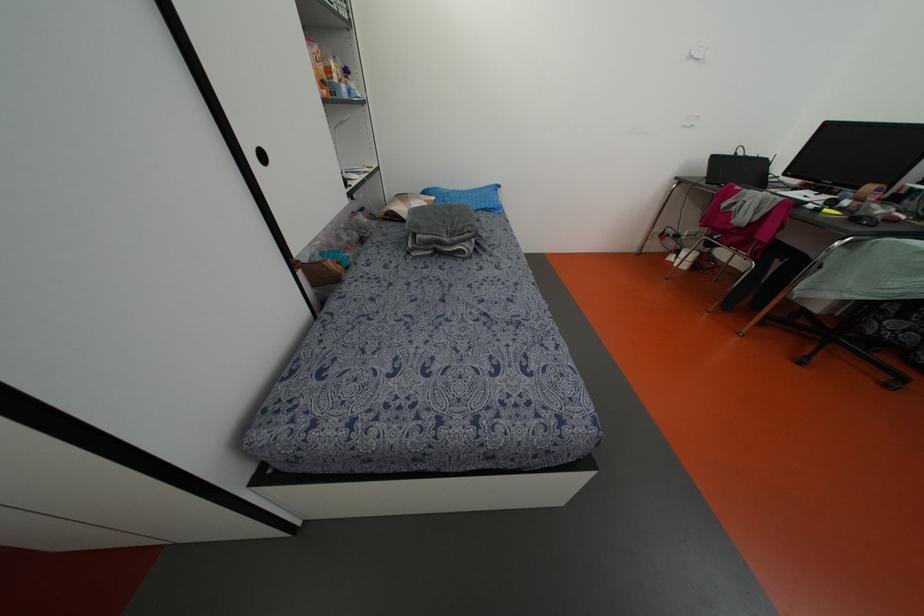
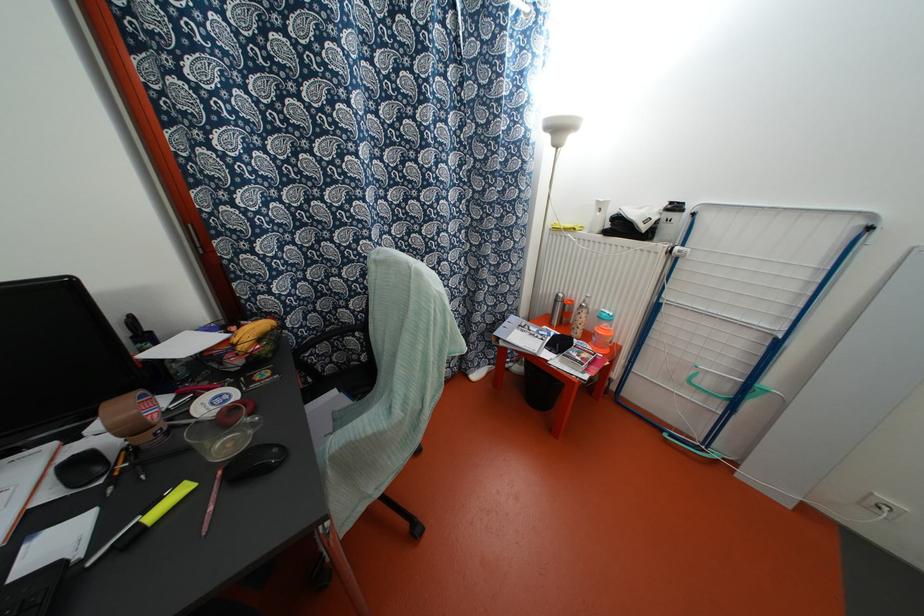
In the second image, find the point that corresponds to pixel 856 199 in the first image.

(131, 429)